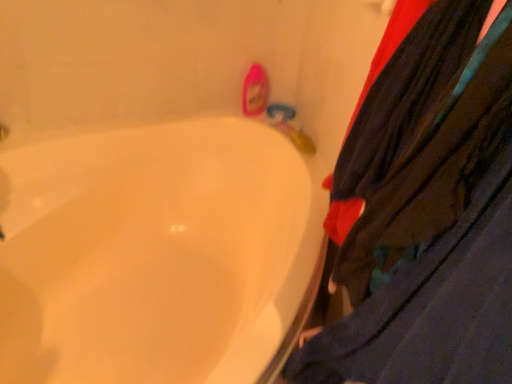
Question: In the image, is white glossy bathtub at lower left on the left side or the right side of velvet-like dark blue pants at right?

Choices:
 (A) right
 (B) left

Answer: (B)

Question: From the image's perspective, is white glossy bathtub at lower left positioned above or below velvet-like dark blue pants at right?

Choices:
 (A) below
 (B) above

Answer: (A)

Question: From their relative heights in the image, would you say white glossy bathtub at lower left is taller or shorter than velvet-like dark blue pants at right?

Choices:
 (A) short
 (B) tall

Answer: (A)

Question: In terms of width, does velvet-like dark blue pants at right look wider or thinner when compared to white glossy bathtub at lower left?

Choices:
 (A) wide
 (B) thin

Answer: (B)

Question: Is velvet-like dark blue pants at right spatially inside white glossy bathtub at lower left, or outside of it?

Choices:
 (A) outside
 (B) inside

Answer: (A)

Question: From the image's perspective, is velvet-like dark blue pants at right positioned above or below white glossy bathtub at lower left?

Choices:
 (A) below
 (B) above

Answer: (B)

Question: Is velvet-like dark blue pants at right bigger or smaller than white glossy bathtub at lower left?

Choices:
 (A) big
 (B) small

Answer: (B)